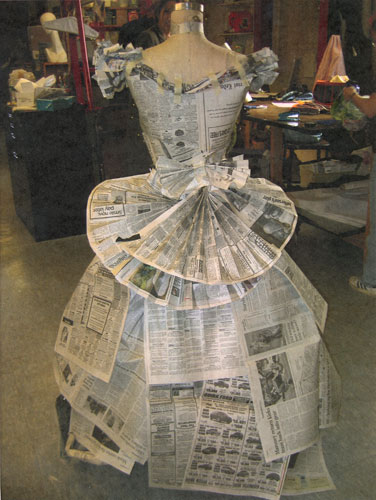
Locate an element on the screen. The height and width of the screenshot is (500, 376). shoe is located at coordinates pyautogui.click(x=356, y=286).